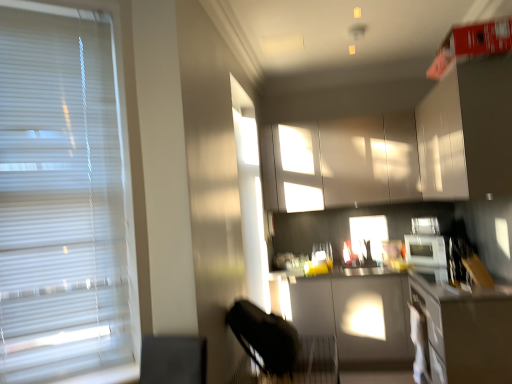
Question: From a real-world perspective, is white glossy cabinets at upper center, acting as the 1th cabinetry starting from the back, located higher than matte gray countertop at center, which appears as the second counter top when viewed from the front?

Choices:
 (A) yes
 (B) no

Answer: (A)

Question: Does white glossy cabinets at upper center, the second cabinetry in the front-to-back sequence, have a lesser width compared to matte gray countertop at center, the 1th counter top viewed from the top?

Choices:
 (A) no
 (B) yes

Answer: (B)

Question: Is white glossy cabinets at upper center, the second cabinetry in the front-to-back sequence, to the left of matte gray countertop at center, which ranks as the first counter top in back-to-front order, from the viewer's perspective?

Choices:
 (A) no
 (B) yes

Answer: (B)

Question: Is matte gray countertop at center, arranged as the second counter top when ordered from the bottom, located within white glossy cabinets at upper center, acting as the 1th cabinetry starting from the back?

Choices:
 (A) no
 (B) yes

Answer: (A)

Question: Is white glossy cabinets at upper center, acting as the 1th cabinetry starting from the back, positioned before matte gray countertop at center, arranged as the second counter top when ordered from the bottom?

Choices:
 (A) no
 (B) yes

Answer: (A)

Question: Is point (10, 324) positioned closer to the camera than point (425, 307)?

Choices:
 (A) closer
 (B) farther

Answer: (A)

Question: In terms of height, does white blinds at left look taller or shorter compared to smooth gray countertop at lower right, arranged as the 1th counter top when ordered from the bottom?

Choices:
 (A) short
 (B) tall

Answer: (B)

Question: Looking at their shapes, would you say white blinds at left is wider or thinner than smooth gray countertop at lower right, arranged as the first counter top when viewed from the front?

Choices:
 (A) wide
 (B) thin

Answer: (B)

Question: Based on their sizes in the image, would you say white blinds at left is bigger or smaller than smooth gray countertop at lower right, which appears as the 2th counter top when viewed from the top?

Choices:
 (A) big
 (B) small

Answer: (B)

Question: Is point (452, 297) closer or farther from the camera than point (454, 198)?

Choices:
 (A) farther
 (B) closer

Answer: (B)

Question: Is matte gray countertop at center, which ranks as the first counter top in back-to-front order, wider or thinner than white glossy cabinet at upper right, which appears as the 2th cabinetry when viewed from the back?

Choices:
 (A) wide
 (B) thin

Answer: (A)

Question: From a real-world perspective, is matte gray countertop at center, arranged as the second counter top when ordered from the bottom, positioned above or below white glossy cabinet at upper right, which appears as the 2th cabinetry when viewed from the back?

Choices:
 (A) below
 (B) above

Answer: (A)

Question: Is matte gray countertop at center, which appears as the second counter top when viewed from the front, spatially inside white glossy cabinet at upper right, which appears as the 2th cabinetry when viewed from the back, or outside of it?

Choices:
 (A) outside
 (B) inside

Answer: (A)

Question: Considering the positions of point (437, 261) and point (41, 233), is point (437, 261) closer or farther from the camera than point (41, 233)?

Choices:
 (A) closer
 (B) farther

Answer: (B)

Question: From a real-world perspective, is white glossy microwave at right physically located above or below white blinds at left?

Choices:
 (A) below
 (B) above

Answer: (A)